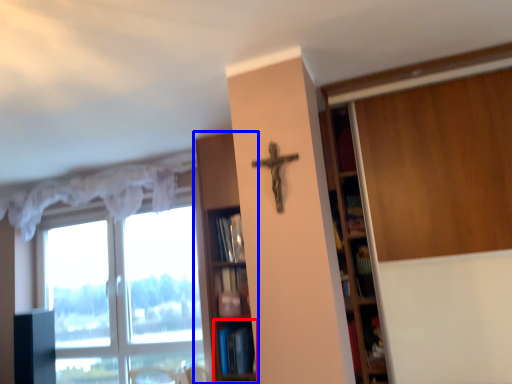
Question: Among these objects, which one is nearest to the camera, shelf (highlighted by a red box) or shelf (highlighted by a blue box)?

Choices:
 (A) shelf
 (B) shelf

Answer: (B)